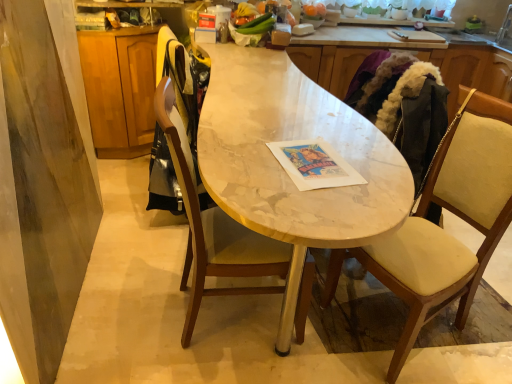
The image size is (512, 384). What are the coordinates of `vacant space that is to the left of wooden chair at center, the 2th chair when ordered from right to left` in the screenshot? It's located at (125, 300).